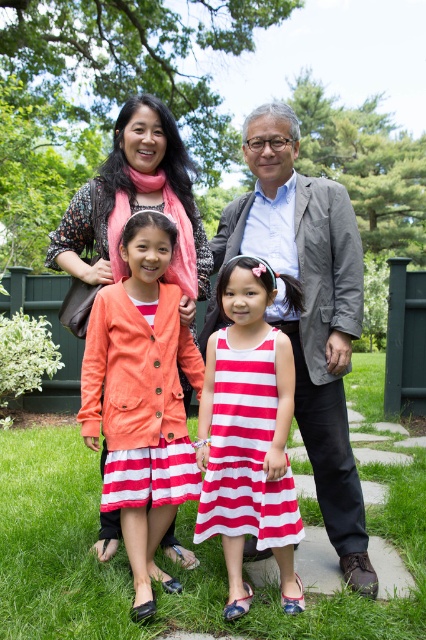
You are a photographer trying to capture the family in the image. You notice the matte coral jacket at center and the striped cotton dress at center. Which clothing item is positioned higher on the person wearing it?

The matte coral jacket at center is above the striped cotton dress at center, so the matte coral jacket at center is positioned higher on the person wearing it.

You are standing in the park and see two points marked on the ground. The first point is at coordinates point (247,160) and the second is at point (290,566). Which point is closer to you?

Point (247,160) is closer to you because it is further to the viewer than point (290,566).

You are a photographer trying to capture a family photo. You notice two clothing items in the center of the image, the matte coral jacket at center and the gray textured blazer at center. Based on their positions, which clothing item should you focus on first if you want to start from the left side of the scene?

The gray textured blazer at center should be focused on first since it is positioned to the left of the matte coral jacket at center.